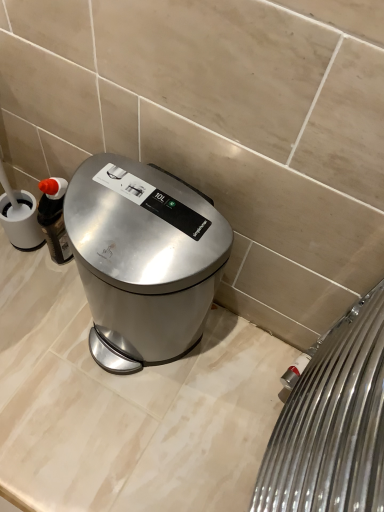
The width and height of the screenshot is (384, 512). What do you see at coordinates (143, 259) in the screenshot?
I see `satin silver trash can at lower left` at bounding box center [143, 259].

Locate an element on the screen. This screenshot has width=384, height=512. satin silver trash can at lower left is located at coordinates click(x=143, y=259).

Find the location of a particular element. The width and height of the screenshot is (384, 512). satin silver trash can at lower left is located at coordinates (143, 259).